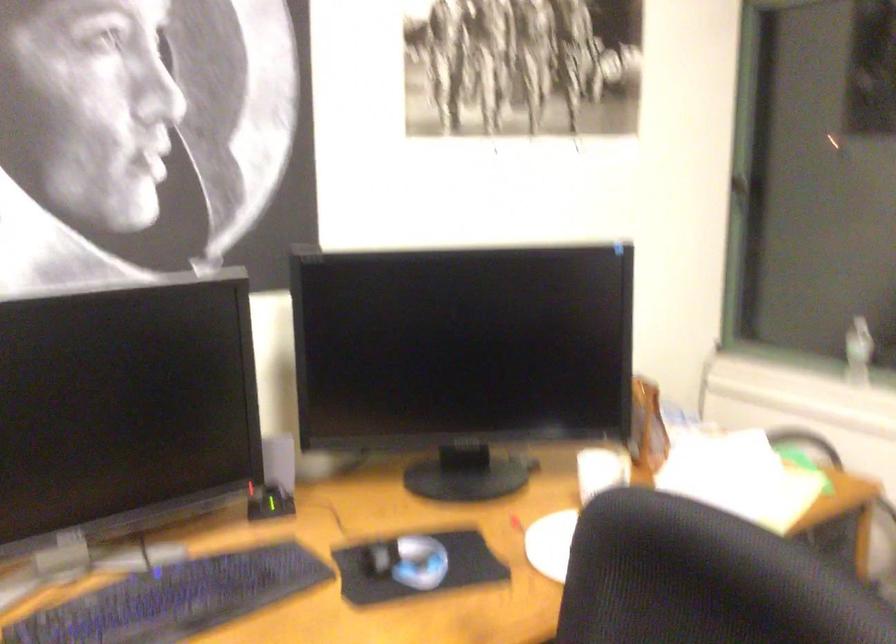
The location [600,471] corresponds to which object?

It corresponds to the white mug in the image.